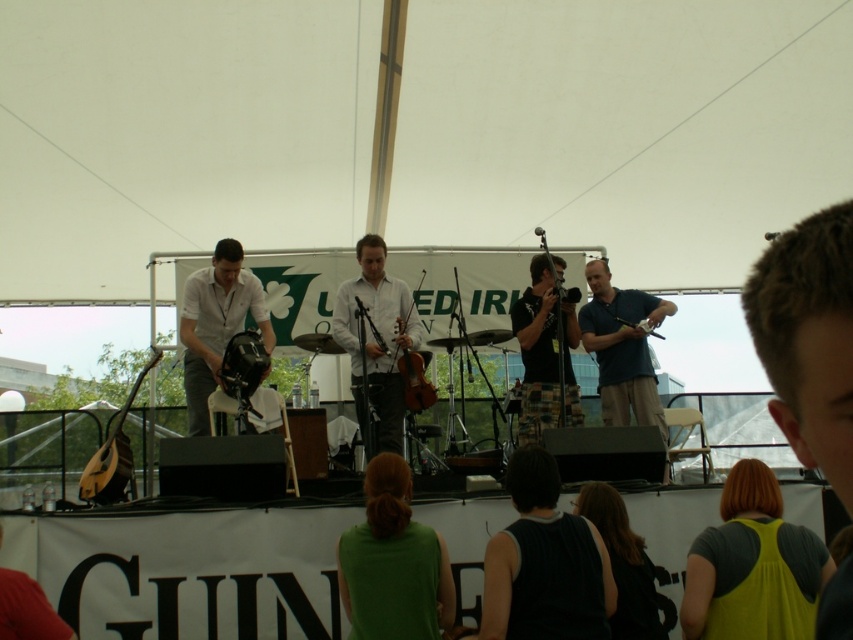
Is wooden violin at center taller than brown wooden violin at center?

Yes.

Can you confirm if wooden violin at center is shorter than brown wooden violin at center?

No, wooden violin at center is not shorter than brown wooden violin at center.

Who is more forward, (376,316) or (413,394)?

Point (413,394)

Identify the location of wooden violin at center. This screenshot has width=853, height=640. [376, 340].

Between point (422, 608) and point (404, 349), which one is positioned behind?

The point (404, 349) is more distant.

Between green fabric shirt at center and brown wooden violin at center, which one appears on the left side from the viewer's perspective?

From the viewer's perspective, green fabric shirt at center appears more on the left side.

Which is behind, point (376, 484) or point (399, 362)?

The point (399, 362) is behind.

Locate an element on the screen. This screenshot has height=640, width=853. green fabric shirt at center is located at coordinates (393, 563).

Between blue cotton shirt at center and matte black helmet at center, which one appears on the right side from the viewer's perspective?

blue cotton shirt at center

Is blue cotton shirt at center to the left of matte black helmet at center from the viewer's perspective?

No, blue cotton shirt at center is not to the left of matte black helmet at center.

Image resolution: width=853 pixels, height=640 pixels. In order to click on blue cotton shirt at center in this screenshot , I will do `click(622, 348)`.